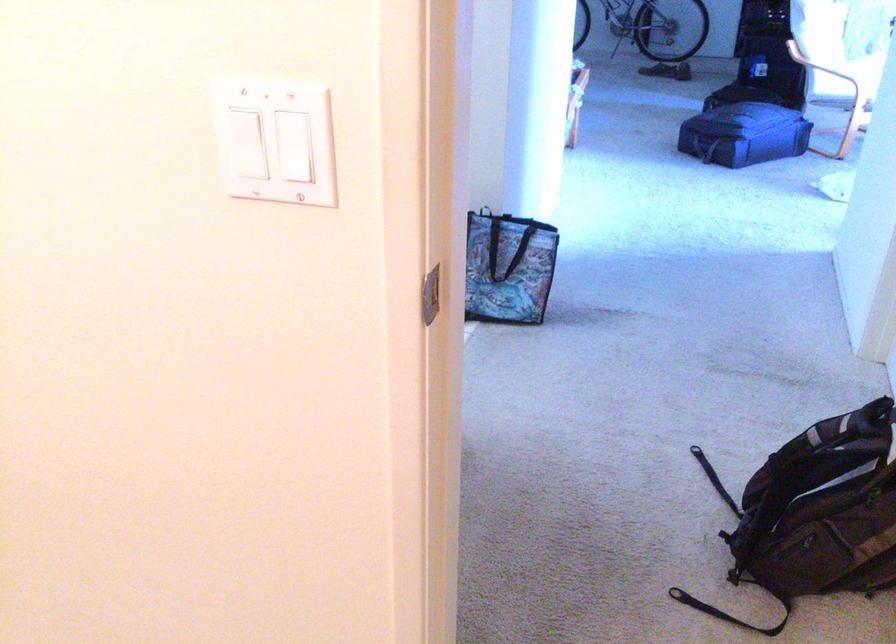
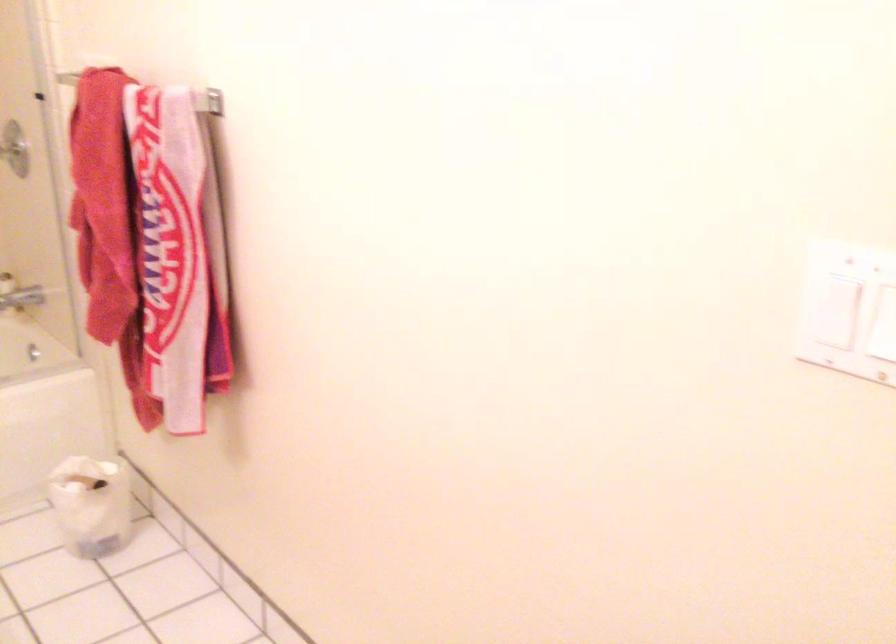
Question: How did the camera likely rotate?

Choices:
 (A) Left
 (B) Right
 (C) Up
 (D) Down

Answer: (A)